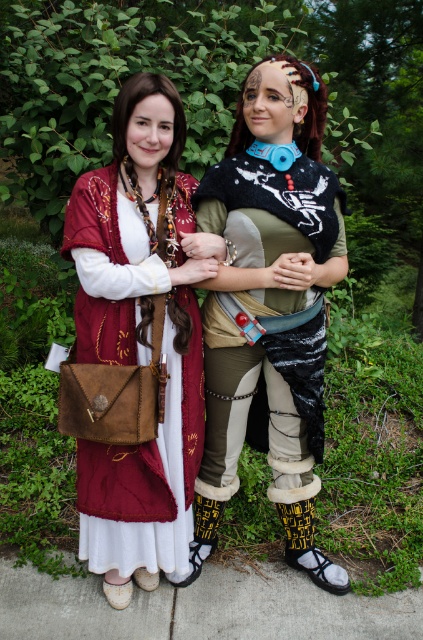
Question: Does matte brown leather purse at center appear over suede brown purse at center?

Choices:
 (A) yes
 (B) no

Answer: (A)

Question: Which point is closer to the camera taking this photo?

Choices:
 (A) (118, 499)
 (B) (296, 563)

Answer: (A)

Question: Among these objects, which one is farthest from the camera?

Choices:
 (A) matte brown leather purse at center
 (B) suede brown purse at center

Answer: (B)

Question: Can you confirm if matte brown leather purse at center is positioned below suede brown purse at center?

Choices:
 (A) no
 (B) yes

Answer: (A)

Question: Is the position of matte brown leather purse at center less distant than that of suede brown purse at center?

Choices:
 (A) yes
 (B) no

Answer: (A)